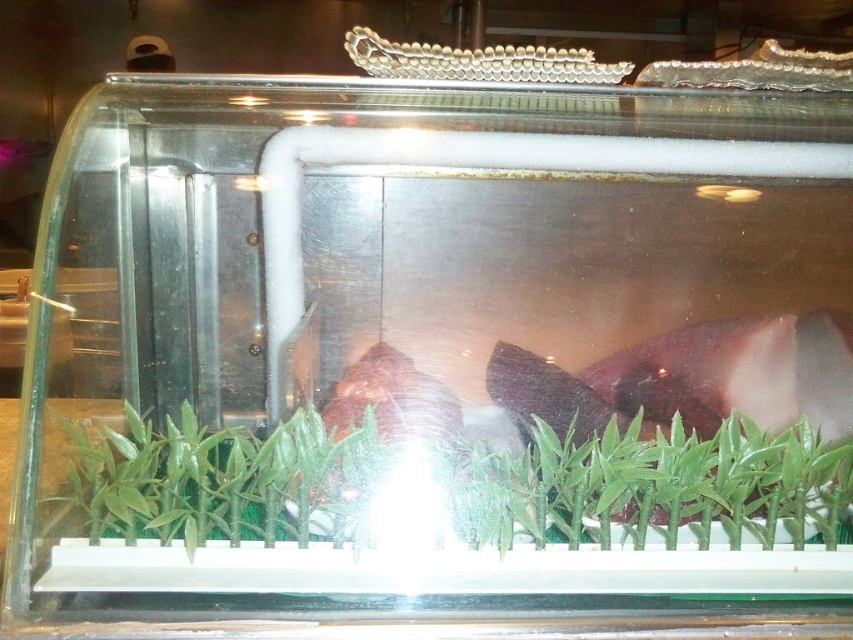
You are standing in front of the display case and want to determine the relative positions of two points inside it. The first point is at coordinates point (x=723, y=472) and the second is at point (x=140, y=468). Which point is closer to you?

Point (x=723, y=472) is further to the viewer than point (x=140, y=468), so the second point is closer to you.

You are a store employee who needs to place a new sign that is 9 inches wide between the green matte bamboo at lower center and the green matte plant at center in the display case. Can the sign fit between them without overlapping either plant?

The distance between the green matte bamboo at lower center and the green matte plant at center is 8.60 inches. Since the sign is 9 inches wide, it is slightly wider than the available space. Therefore, the sign cannot fit between them without overlapping one of the plants.